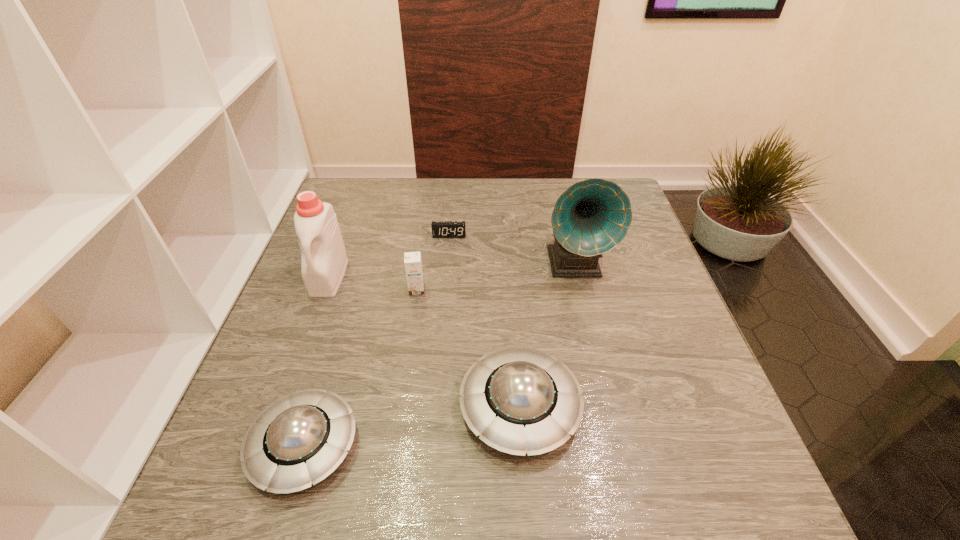
Please point a spot to add another saucer on the right. Please provide its 2D coordinates. Your answer should be formatted as a tuple, i.e. [(x, y)], where the tuple contains the x and y coordinates of a point satisfying the conditions above.

[(708, 373)]